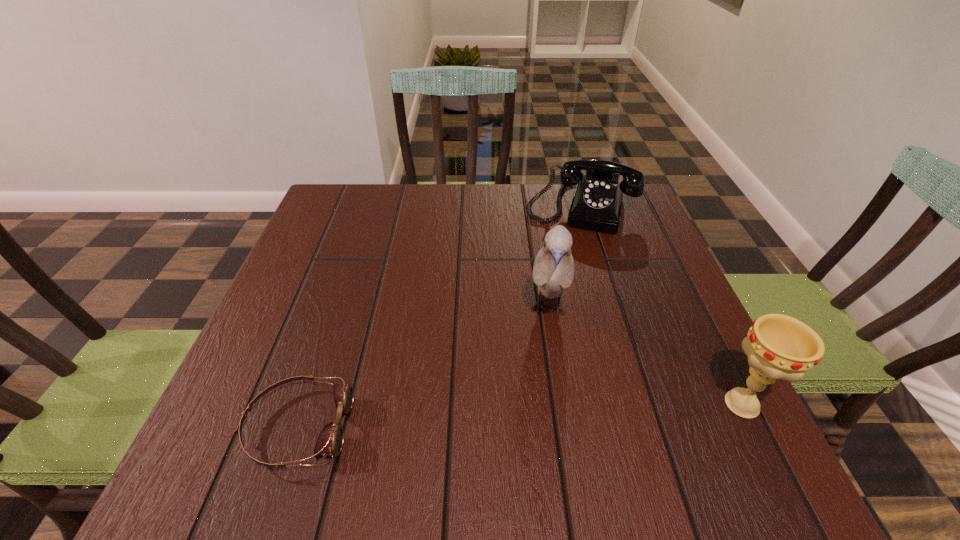
Identify the location of empty location between the bird and the shortest object. The height and width of the screenshot is (540, 960). (422, 368).

Identify the location of vacant area between the farthest object and the shortest object. (439, 318).

Locate an element on the screen. The height and width of the screenshot is (540, 960). free area in between the goggles and the second shortest object is located at coordinates (439, 318).

I want to click on free spot between the farthest object and the second tallest object, so click(660, 306).

Find the location of a particular element. The height and width of the screenshot is (540, 960). free space that is in between the second tallest object and the third tallest object is located at coordinates (660, 306).

You are a GUI agent. You are given a task and a screenshot of the screen. Output one action in this format:
    pyautogui.click(x=<x>, y=<y>)
    Task: Click on the free space that is in between the farthest object and the chalice
    
    Given the screenshot: What is the action you would take?
    pyautogui.click(x=660, y=306)

This screenshot has height=540, width=960. Find the location of `empty space between the goggles and the second farthest object`. empty space between the goggles and the second farthest object is located at coordinates (422, 368).

Image resolution: width=960 pixels, height=540 pixels. What are the coordinates of `vacant space that is in between the tallest object and the shortest object` in the screenshot? It's located at (422, 368).

Locate an element on the screen. object that is the second closest to the second shortest object is located at coordinates (778, 346).

Identify the location of the third closest object to the tallest object. Image resolution: width=960 pixels, height=540 pixels. (330, 440).